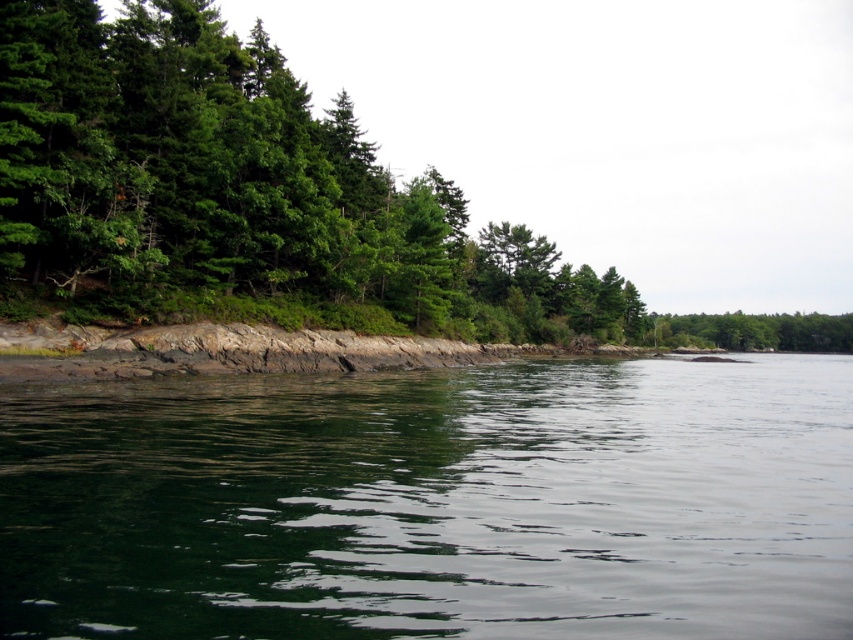
Question: Is green reflective water at center positioned before green matte trees at left?

Choices:
 (A) no
 (B) yes

Answer: (B)

Question: Is green reflective water at center bigger than green matte trees at left?

Choices:
 (A) yes
 (B) no

Answer: (B)

Question: Which object is positioned closest to the green reflective water at center?

Choices:
 (A) green matte trees at left
 (B) green matte tree at center

Answer: (A)

Question: Considering the relative positions of green reflective water at center and green matte tree at center in the image provided, where is green reflective water at center located with respect to green matte tree at center?

Choices:
 (A) above
 (B) below

Answer: (B)

Question: Estimate the real-world distances between objects in this image. Which object is farther from the green reflective water at center?

Choices:
 (A) green matte trees at left
 (B) green matte tree at center

Answer: (B)

Question: Which object is positioned closest to the green matte tree at center?

Choices:
 (A) green matte trees at left
 (B) green reflective water at center

Answer: (A)